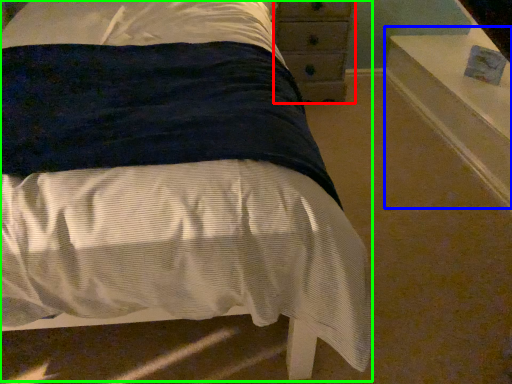
Question: Which object is positioned closest to chest of drawers (highlighted by a red box)? Select from window sill (highlighted by a blue box) and bed (highlighted by a green box).

Choices:
 (A) window sill
 (B) bed

Answer: (A)